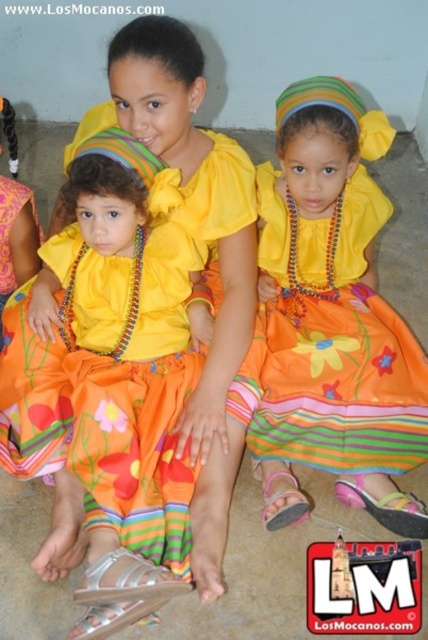
You are a fashion designer observing the three girls. You need to decide which item of clothing, the matte yellow blouse at center or the matte orange dress at center, would require more fabric to create a similar garment. Based on their sizes in the image, which would need more fabric?

The matte orange dress at center would require more fabric because it is taller than the matte yellow blouse at center.

You are a photographer standing in front of the three girls. You want to take a photo that includes both point (172, 531) and point (416, 500). Which point will appear larger in the photo?

Point (172, 531) is closer to the camera than point (416, 500), so it will appear larger in the photo.

You are a costume designer preparing for a play and need to determine which costume piece to adjust. Given the scene described, which of the two items, the matte yellow blouse at center or the matte orange dress at center, requires alterations to fit the actor if the actor is only comfortable wearing garments that are smaller in size?

The matte orange dress at center requires alterations because it is smaller in size than the matte yellow blouse at center, and the actor prefers garments that are smaller in size.